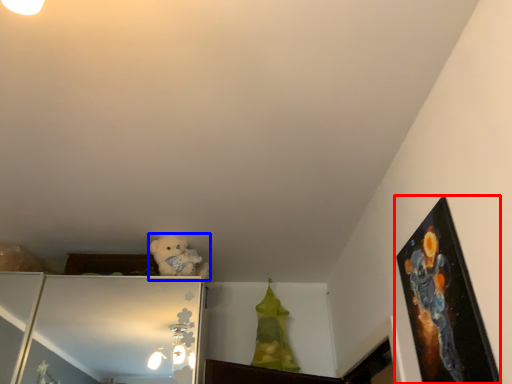
Question: Among these objects, which one is farthest to the camera, picture frame (highlighted by a red box) or animal (highlighted by a blue box)?

Choices:
 (A) picture frame
 (B) animal

Answer: (B)